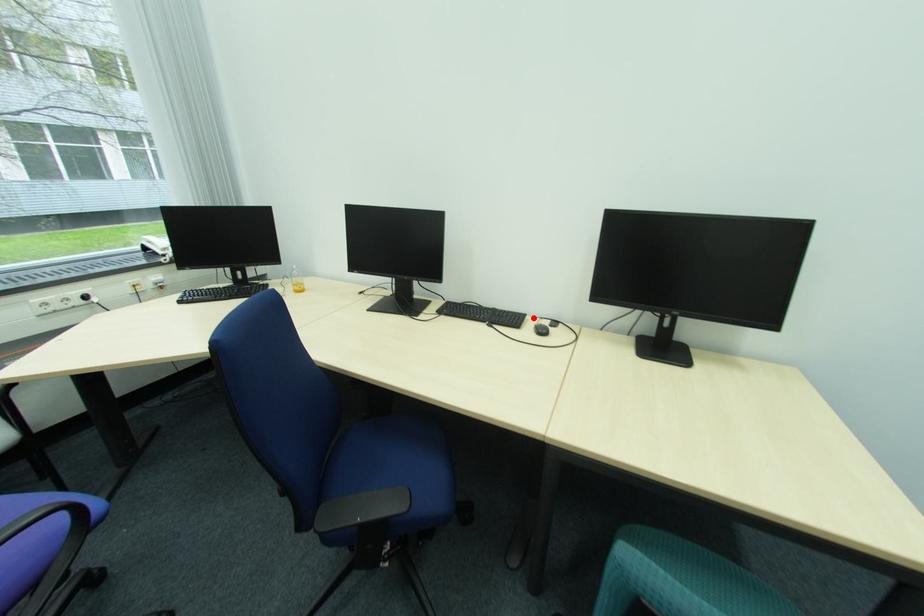
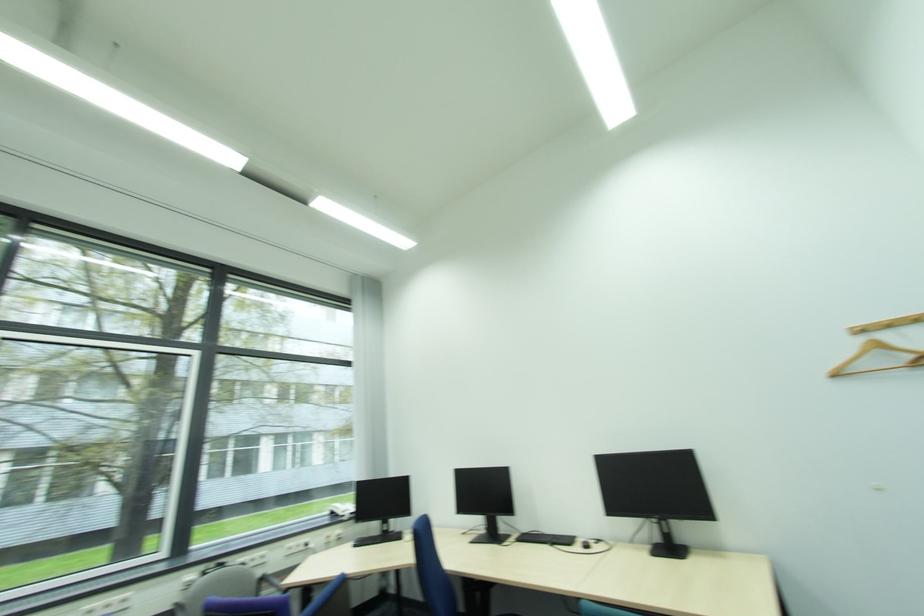
The point at the highlighted location is marked in the first image. Where is the corresponding point in the second image?

(584, 539)